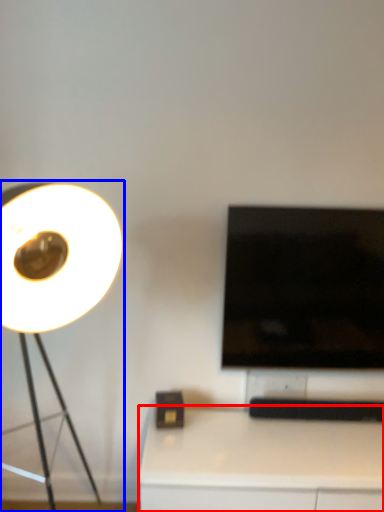
Question: Which object appears closest to the camera in this image, table (highlighted by a red box) or lamp (highlighted by a blue box)?

Choices:
 (A) table
 (B) lamp

Answer: (B)